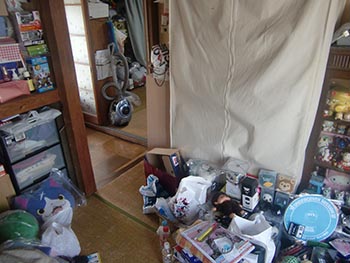
Identify the location of figurines. The width and height of the screenshot is (350, 263). (347, 159), (332, 157), (326, 157), (328, 127), (348, 96).